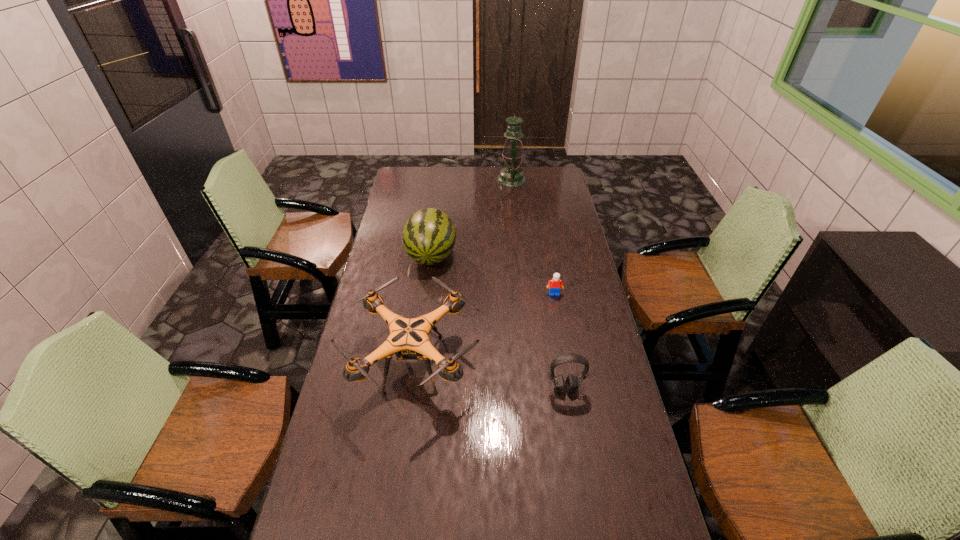
This screenshot has height=540, width=960. In order to click on vacant area that lies between the drone and the second shortest object in this screenshot , I will do `click(490, 376)`.

I want to click on free spot between the drone and the fourth nearest object, so click(422, 310).

The height and width of the screenshot is (540, 960). Identify the location of free space between the drone and the headset. (490, 376).

This screenshot has height=540, width=960. What are the coordinates of `vacant point located between the Lego and the second shortest object` in the screenshot? It's located at (560, 341).

Find the location of a particular element. This screenshot has width=960, height=540. free space between the tallest object and the fourth tallest object is located at coordinates (539, 284).

I want to click on empty space between the fourth tallest object and the farthest object, so click(x=539, y=284).

Where is `the second closest object to the tallest object`? the second closest object to the tallest object is located at coordinates [x=555, y=284].

Identify the location of object that is the closest one to the oil lamp. This screenshot has width=960, height=540. (428, 238).

Find the location of a particular element. The image size is (960, 540). free spot that satisfies the following two spatial constraints: 1. on the face of the third nearest object; 2. on the camera mount of the drone is located at coordinates (566, 363).